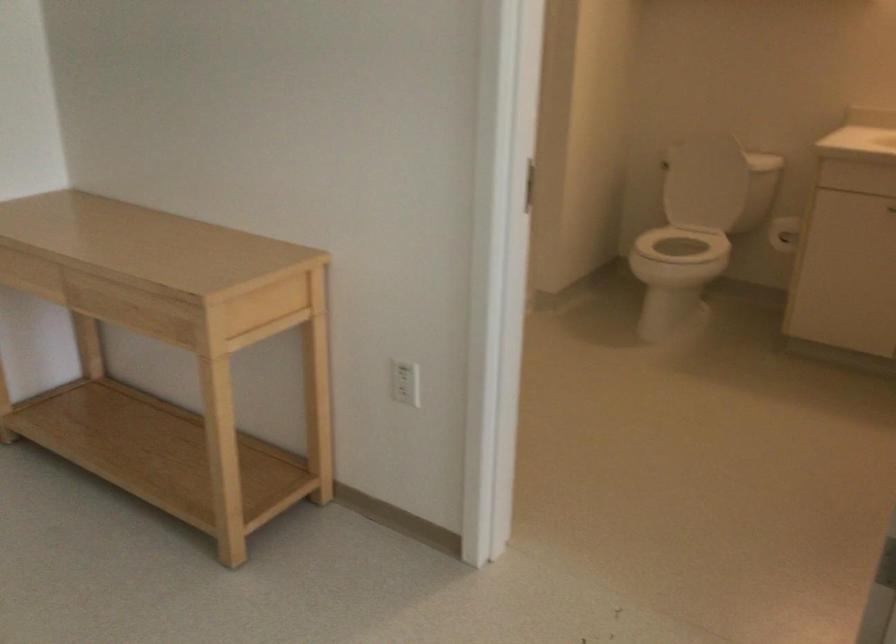
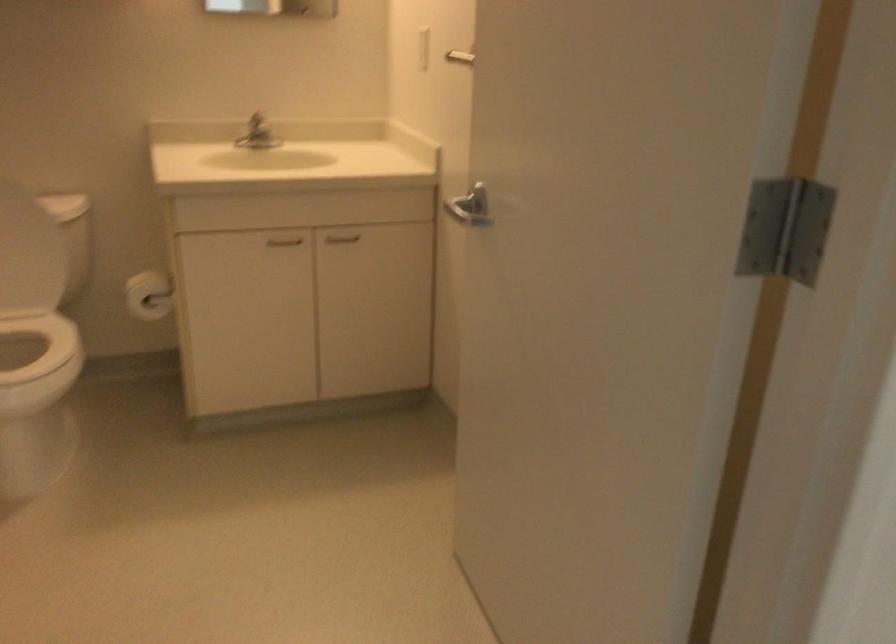
In the second image, find the point that corresponds to [789,225] in the first image.

(149, 295)